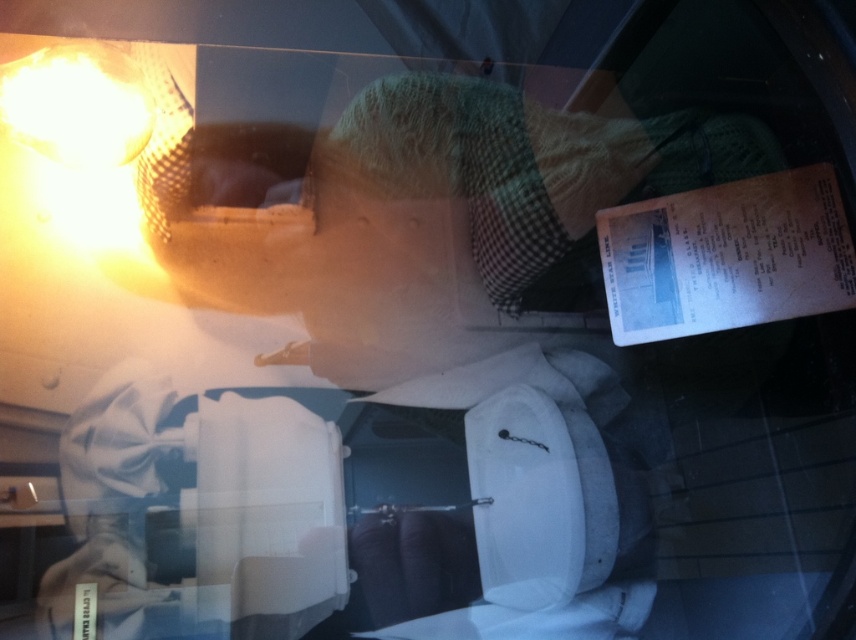
Question: Is green knitted hat at upper center to the right of matte yellow mesh lamp at upper left from the viewer's perspective?

Choices:
 (A) no
 (B) yes

Answer: (B)

Question: Considering the relative positions of green knitted hat at upper center and matte yellow mesh lamp at upper left in the image provided, where is green knitted hat at upper center located with respect to matte yellow mesh lamp at upper left?

Choices:
 (A) left
 (B) right

Answer: (B)

Question: Does green knitted hat at upper center lie behind matte yellow mesh lamp at upper left?

Choices:
 (A) no
 (B) yes

Answer: (B)